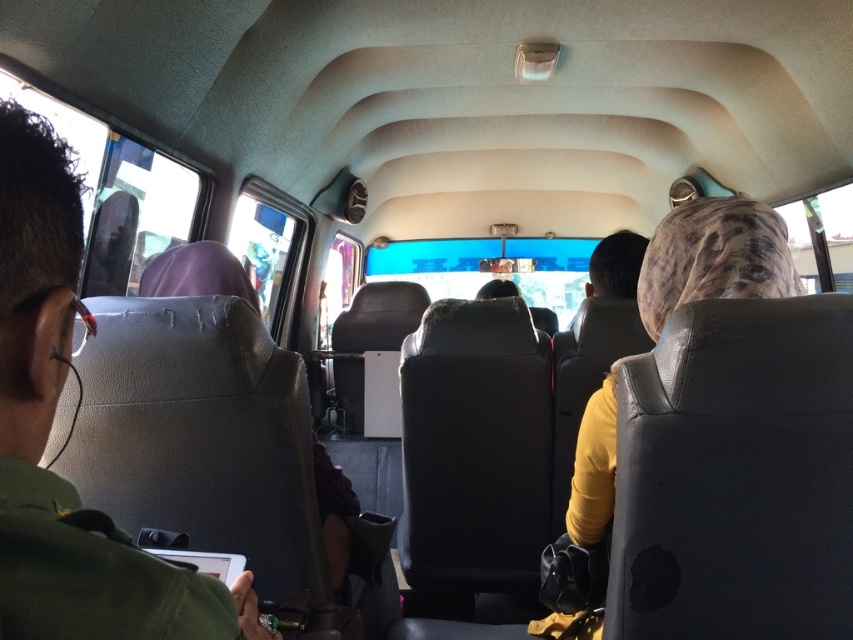
Question: Is green matte uniform at left wider than leather-like purple headscarf at left?

Choices:
 (A) no
 (B) yes

Answer: (A)

Question: Which point appears farthest from the camera in this image?

Choices:
 (A) (148, 285)
 (B) (59, 566)

Answer: (A)

Question: Is the position of green matte uniform at left less distant than that of leather-like purple headscarf at left?

Choices:
 (A) yes
 (B) no

Answer: (A)

Question: Does green matte uniform at left appear over leather-like purple headscarf at left?

Choices:
 (A) yes
 (B) no

Answer: (B)

Question: Which point is closer to the camera taking this photo?

Choices:
 (A) (248, 612)
 (B) (328, 504)

Answer: (A)